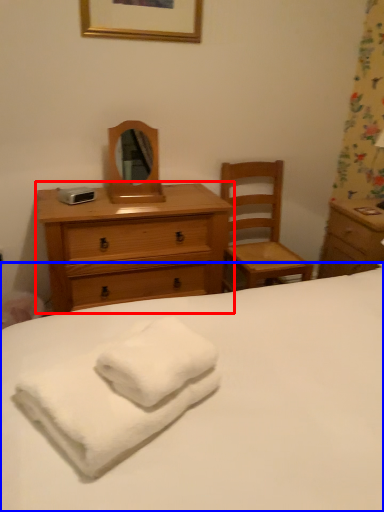
Question: Which of the following is the farthest to the observer, chest of drawers (highlighted by a red box) or bed (highlighted by a blue box)?

Choices:
 (A) chest of drawers
 (B) bed

Answer: (A)